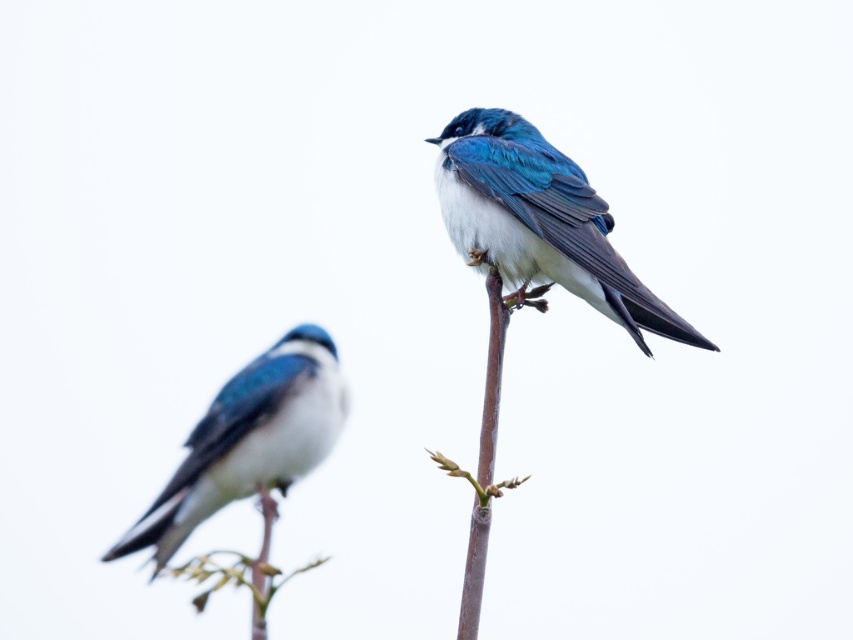
Is shiny blue bird at center taller than white matte bird at center?

Result: Indeed, shiny blue bird at center has a greater height compared to white matte bird at center.

The image size is (853, 640). I want to click on shiny blue bird at center, so click(538, 221).

Where is `shiny blue bird at center`? The width and height of the screenshot is (853, 640). shiny blue bird at center is located at coordinates (538, 221).

Between white matte bird at center and green leafy branch at lower left, which one appears on the left side from the viewer's perspective?

Positioned to the left is white matte bird at center.

Which is above, white matte bird at center or green leafy branch at lower left?

white matte bird at center

Identify the location of white matte bird at center. (248, 440).

Locate an element on the screen. white matte bird at center is located at coordinates (248, 440).

Between shiny blue bird at center and green leafy branch at lower left, which one is positioned higher?

shiny blue bird at center

Where is `shiny blue bird at center`? The image size is (853, 640). shiny blue bird at center is located at coordinates (538, 221).

At what (x,y) coordinates should I click in order to perform the action: click on shiny blue bird at center. Please return your answer as a coordinate pair (x, y). Image resolution: width=853 pixels, height=640 pixels. Looking at the image, I should click on (538, 221).